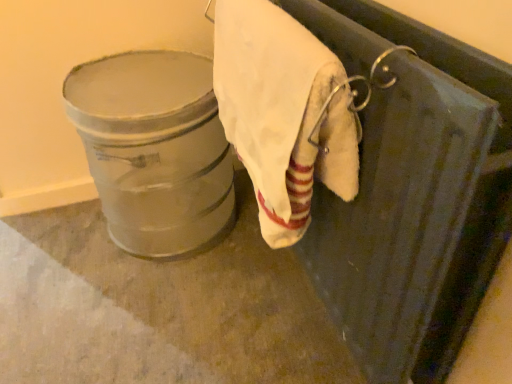
The image size is (512, 384). Identify the location of vacant space that is to the left of metallic silver bucket at left. (53, 248).